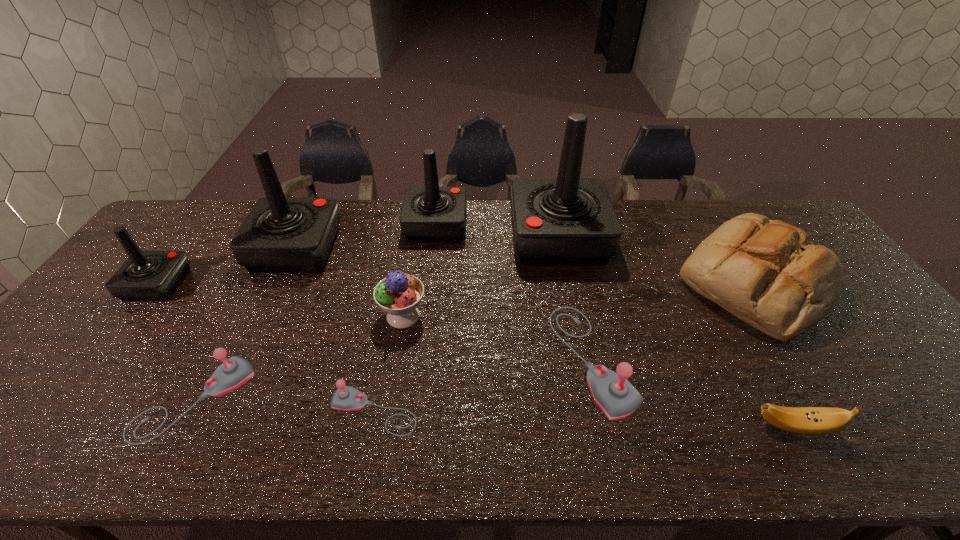
Where is `the biggest gray joystick`? The image size is (960, 540). the biggest gray joystick is located at coordinates click(x=614, y=394).

You are a GUI agent. You are given a task and a screenshot of the screen. Output one action in this format:
    pyautogui.click(x=<x>, y=<y>)
    Task: Click on the seventh tallest object
    
    Given the screenshot: What is the action you would take?
    pyautogui.click(x=614, y=394)

Locate an element on the screen. This screenshot has width=960, height=540. the leftmost gray joystick is located at coordinates (233, 372).

The width and height of the screenshot is (960, 540). What are the coordinates of `the sixth tallest joystick` in the screenshot? It's located at (233, 372).

The height and width of the screenshot is (540, 960). Find the location of `yellow banana`. yellow banana is located at coordinates (804, 420).

Identify the location of the smallest gray joystick. pyautogui.click(x=346, y=398).

Identify the location of the shortest joystick. The width and height of the screenshot is (960, 540). (346, 398).

The width and height of the screenshot is (960, 540). In order to click on vacant point located 0.330m on the front-facing side of the tallest joystick in this screenshot , I will do `click(411, 238)`.

What are the coordinates of `vacant space located 0.320m on the front-facing side of the tallest joystick` in the screenshot? It's located at (414, 238).

Where is `vacant space located 0.380m on the front-facing side of the tallest joystick`? This screenshot has height=540, width=960. vacant space located 0.380m on the front-facing side of the tallest joystick is located at coordinates (396, 238).